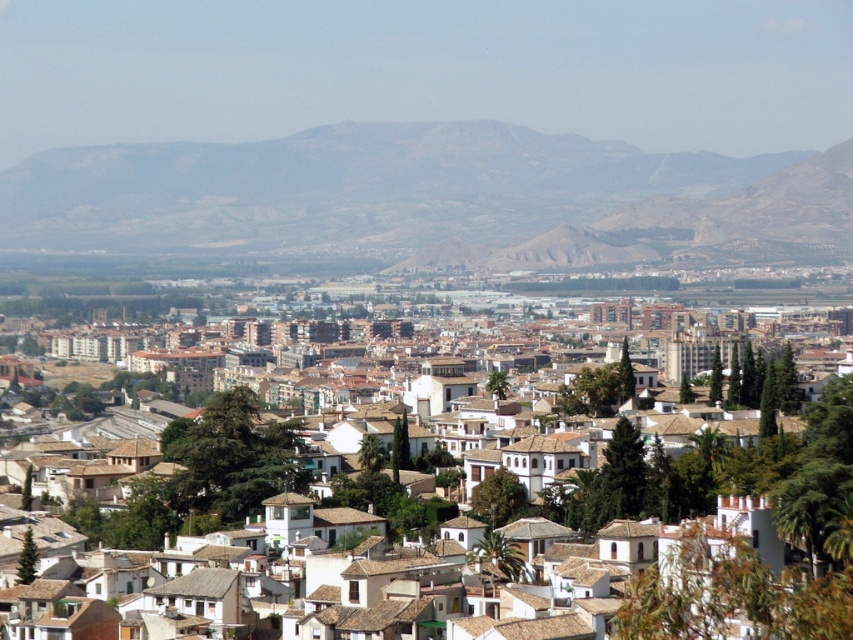
Question: Estimate the real-world distances between objects in this image. Which object is closer to the gray rocky mountain at upper center?

Choices:
 (A) rugged brown hillside at center
 (B) white clay buildings at center

Answer: (A)

Question: Which of these objects is positioned closest to the white clay buildings at center?

Choices:
 (A) gray rocky mountain at upper center
 (B) rugged brown hillside at center

Answer: (B)

Question: Is gray rocky mountain at upper center to the right of rugged brown hillside at center from the viewer's perspective?

Choices:
 (A) no
 (B) yes

Answer: (A)

Question: Is white clay buildings at center bigger than rugged brown hillside at center?

Choices:
 (A) no
 (B) yes

Answer: (B)

Question: Based on their relative distances, which object is farther from the gray rocky mountain at upper center?

Choices:
 (A) rugged brown hillside at center
 (B) white clay buildings at center

Answer: (B)

Question: Can you confirm if white clay buildings at center is thinner than rugged brown hillside at center?

Choices:
 (A) yes
 (B) no

Answer: (A)